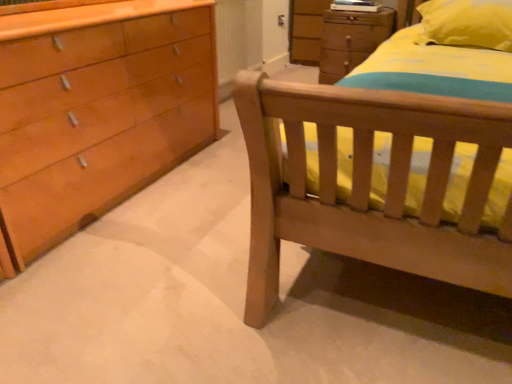
Question: Does wooden chest of drawers at upper center have a smaller size compared to yellow fabric pillow at upper right?

Choices:
 (A) yes
 (B) no

Answer: (B)

Question: Can you confirm if wooden chest of drawers at upper center is wider than yellow fabric pillow at upper right?

Choices:
 (A) no
 (B) yes

Answer: (A)

Question: From a real-world perspective, is wooden chest of drawers at upper center on yellow fabric pillow at upper right?

Choices:
 (A) no
 (B) yes

Answer: (A)

Question: Can you confirm if wooden chest of drawers at upper center is bigger than yellow fabric pillow at upper right?

Choices:
 (A) no
 (B) yes

Answer: (B)

Question: Is there a large distance between wooden chest of drawers at upper center and yellow fabric pillow at upper right?

Choices:
 (A) no
 (B) yes

Answer: (A)

Question: Considering the relative positions of wooden chest of drawers at upper center and yellow fabric pillow at upper right in the image provided, is wooden chest of drawers at upper center to the left of yellow fabric pillow at upper right from the viewer's perspective?

Choices:
 (A) yes
 (B) no

Answer: (A)

Question: From the image's perspective, is yellow fabric pillow at upper right above wooden chest of drawers at upper center?

Choices:
 (A) no
 (B) yes

Answer: (A)

Question: Considering the relative positions of yellow fabric pillow at upper right and wooden chest of drawers at upper center in the image provided, is yellow fabric pillow at upper right to the right of wooden chest of drawers at upper center from the viewer's perspective?

Choices:
 (A) yes
 (B) no

Answer: (A)

Question: From the image's perspective, is yellow fabric pillow at upper right located beneath wooden chest of drawers at upper center?

Choices:
 (A) yes
 (B) no

Answer: (A)

Question: Considering the relative sizes of yellow fabric pillow at upper right and wooden chest of drawers at upper center in the image provided, is yellow fabric pillow at upper right thinner than wooden chest of drawers at upper center?

Choices:
 (A) no
 (B) yes

Answer: (A)

Question: Is yellow fabric pillow at upper right to the left of wooden chest of drawers at upper center from the viewer's perspective?

Choices:
 (A) no
 (B) yes

Answer: (A)

Question: Is yellow fabric pillow at upper right in contact with wooden chest of drawers at upper center?

Choices:
 (A) no
 (B) yes

Answer: (A)

Question: Is wooden chest of drawers at upper center wider or thinner than yellow fabric pillow at upper right?

Choices:
 (A) wide
 (B) thin

Answer: (B)